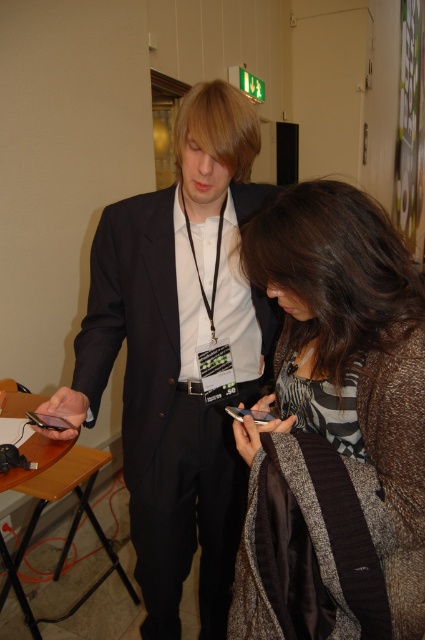
You are standing in the hallway and need to locate the striped fabric shirt at center. According to the coordinates provided, where exactly should you look?

The striped fabric shirt at center is located at point coordinates (334,428).

You are standing in the hallway and need to locate the person wearing the striped fabric shirt at center and the black matte suit at center. Which one is positioned to the right side of the other?

The striped fabric shirt at center is to the right of the black matte suit at center.

You are standing in a hallway and see the black matte suit at center and the matte black smartphone at center. Which object is positioned lower from the ground?

The black matte suit at center is located below the matte black smartphone at center, so the black matte suit at center is positioned lower from the ground.